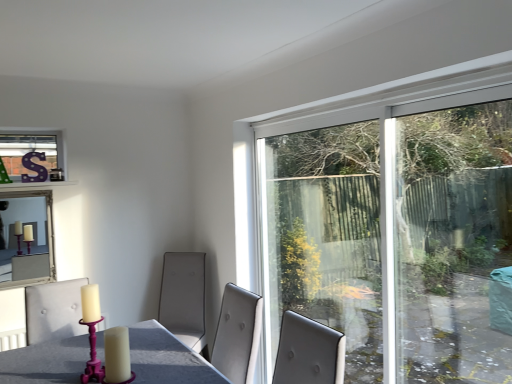
What is the approximate height of transparent glass window at upper right?

The height of transparent glass window at upper right is 1.52 meters.

What do you see at coordinates (391, 232) in the screenshot?
I see `transparent glass window at upper right` at bounding box center [391, 232].

This screenshot has height=384, width=512. In order to click on transparent glass window at upper right in this screenshot , I will do `click(391, 232)`.

Identify the location of silver-framed mirror at upper left. (47, 222).

Looking at this image, in order to face silver-framed mirror at upper left, should I rotate leftwards or rightwards?

Turn left approximately 28.159 degrees to face it.

The width and height of the screenshot is (512, 384). What do you see at coordinates (47, 222) in the screenshot? I see `silver-framed mirror at upper left` at bounding box center [47, 222].

I want to click on transparent glass window at upper right, so click(391, 232).

In the image, is silver-framed mirror at upper left on the left side or the right side of transparent glass window at upper right?

silver-framed mirror at upper left is to the left of transparent glass window at upper right.

Which object is closer to the camera, silver-framed mirror at upper left or transparent glass window at upper right?

transparent glass window at upper right is in front.

Is point (17, 195) positioned after point (408, 378)?

Yes, it is.

From the image's perspective, which is below, silver-framed mirror at upper left or transparent glass window at upper right?

silver-framed mirror at upper left is shown below in the image.

From a real-world perspective, between silver-framed mirror at upper left and transparent glass window at upper right, who is vertically lower?

In real-world perspective, silver-framed mirror at upper left is lower.

In terms of width, does silver-framed mirror at upper left look wider or thinner when compared to transparent glass window at upper right?

silver-framed mirror at upper left is wider than transparent glass window at upper right.

Considering the sizes of objects silver-framed mirror at upper left and transparent glass window at upper right in the image provided, who is shorter, silver-framed mirror at upper left or transparent glass window at upper right?

silver-framed mirror at upper left.

Which of these two, silver-framed mirror at upper left or transparent glass window at upper right, is bigger?

transparent glass window at upper right.

Is silver-framed mirror at upper left situated inside transparent glass window at upper right or outside?

silver-framed mirror at upper left lies outside transparent glass window at upper right.

Is silver-framed mirror at upper left touching transparent glass window at upper right?

silver-framed mirror at upper left and transparent glass window at upper right are not in contact.

Is silver-framed mirror at upper left facing away from transparent glass window at upper right?

No.

What are the coordinates of `window screen below the transparent glass window at upper right (from the image's perspective)` in the screenshot? It's located at (47, 222).

Is transparent glass window at upper right to the left of silver-framed mirror at upper left from the viewer's perspective?

No.

Does transparent glass window at upper right lie in front of silver-framed mirror at upper left?

Yes.

Which is behind, point (318, 279) or point (48, 242)?

The point (48, 242) is farther from the camera.

From the image's perspective, is transparent glass window at upper right above silver-framed mirror at upper left?

Yes, from the image's perspective, transparent glass window at upper right is above silver-framed mirror at upper left.

From a real-world perspective, which object stands above the other?

transparent glass window at upper right.

In terms of width, does transparent glass window at upper right look wider or thinner when compared to silver-framed mirror at upper left?

Considering their sizes, transparent glass window at upper right looks slimmer than silver-framed mirror at upper left.

In terms of height, does transparent glass window at upper right look taller or shorter compared to silver-framed mirror at upper left?

transparent glass window at upper right is taller than silver-framed mirror at upper left.

Based on their sizes in the image, would you say transparent glass window at upper right is bigger or smaller than silver-framed mirror at upper left?

In the image, transparent glass window at upper right appears to be larger than silver-framed mirror at upper left.

Is transparent glass window at upper right completely or partially outside of silver-framed mirror at upper left?

Absolutely, transparent glass window at upper right is external to silver-framed mirror at upper left.

Would you say transparent glass window at upper right is a long distance from silver-framed mirror at upper left?

Yes, transparent glass window at upper right and silver-framed mirror at upper left are located far from each other.

Is transparent glass window at upper right oriented away from silver-framed mirror at upper left?

No, silver-framed mirror at upper left is not at the back of transparent glass window at upper right.

What's the angular difference between transparent glass window at upper right and silver-framed mirror at upper left's facing directions?

89.5 degrees.

How distant is transparent glass window at upper right from silver-framed mirror at upper left?

transparent glass window at upper right is 2.24 meters away from silver-framed mirror at upper left.

At what (x,y) coordinates should I click in order to perform the action: click on window screen on the left of transparent glass window at upper right. Please return your answer as a coordinate pair (x, y). Image resolution: width=512 pixels, height=384 pixels. Looking at the image, I should click on (47, 222).

Where is `window on the right of silver-framed mirror at upper left`? This screenshot has width=512, height=384. window on the right of silver-framed mirror at upper left is located at coordinates (391, 232).

Locate an element on the screen. The height and width of the screenshot is (384, 512). window screen on the left of transparent glass window at upper right is located at coordinates (47, 222).